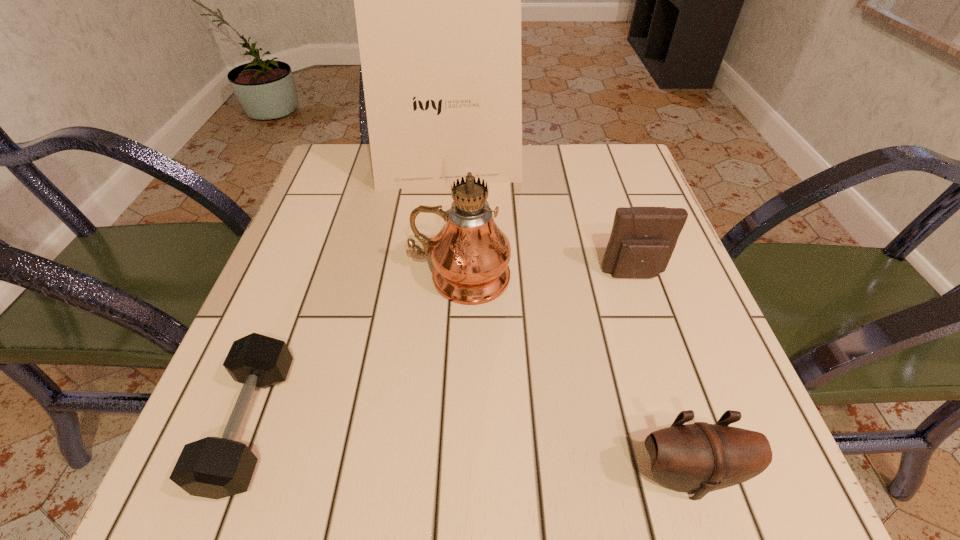
In order to click on object located at the near right corner in this screenshot , I will do `click(698, 458)`.

The width and height of the screenshot is (960, 540). In the image, there is a desktop. What are the coordinates of `vacant space at the near edge` in the screenshot? It's located at (567, 456).

Where is `free point at the left edge`? free point at the left edge is located at coordinates (337, 319).

Where is `free space at the right edge`? Image resolution: width=960 pixels, height=540 pixels. free space at the right edge is located at coordinates (712, 356).

This screenshot has width=960, height=540. In order to click on vacant space at the far left corner in this screenshot , I will do `click(345, 155)`.

This screenshot has height=540, width=960. I want to click on vacant space at the far right corner, so click(x=609, y=166).

This screenshot has width=960, height=540. What are the coordinates of `unoccupied area between the shopping bag and the leftmost object` in the screenshot? It's located at (349, 296).

Locate an element on the screen. The width and height of the screenshot is (960, 540). vacant point located between the farthest object and the nearer pouch is located at coordinates (567, 322).

In order to click on free area in between the farthest object and the farther pouch in this screenshot , I will do `click(540, 221)`.

Locate an element on the screen. This screenshot has height=540, width=960. free spot between the shortest object and the second tallest object is located at coordinates (355, 350).